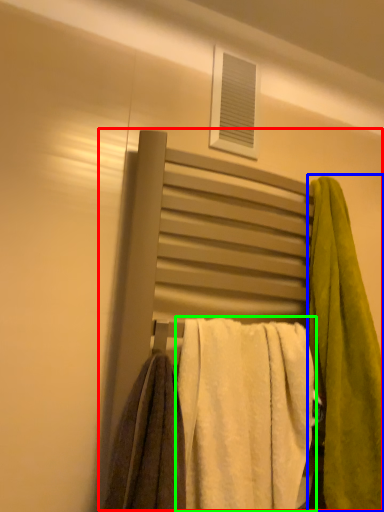
Question: Which object is the closest to the bed (highlighted by a red box)? Choose among these: towel (highlighted by a blue box) or towel (highlighted by a green box).

Choices:
 (A) towel
 (B) towel

Answer: (A)